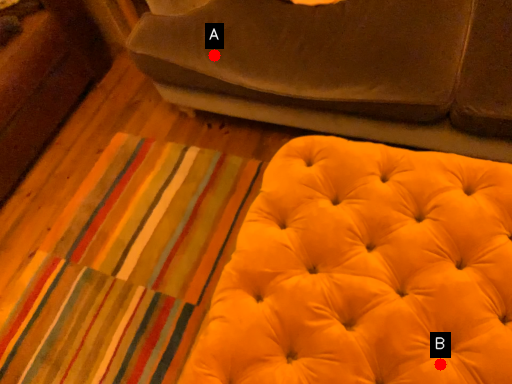
Question: Two points are circled on the image, labeled by A and B beside each circle. Which point is farther to the camera?

Choices:
 (A) A is further
 (B) B is further

Answer: (A)